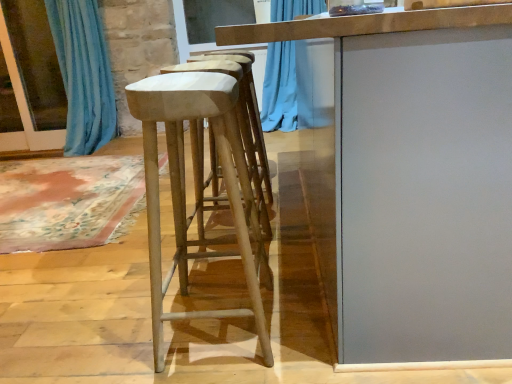
This screenshot has width=512, height=384. I want to click on free location to the left of light brown wood stool at center, so click(109, 330).